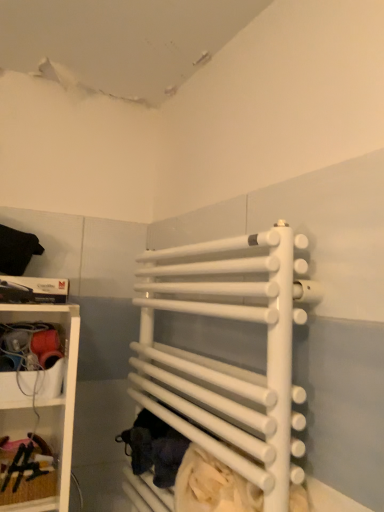
The image size is (384, 512). Identify the location of wooden at left. (55, 450).

What do you see at coordinates (55, 450) in the screenshot? Image resolution: width=384 pixels, height=512 pixels. I see `wooden at left` at bounding box center [55, 450].

Locate an element on the screen. Image resolution: width=384 pixels, height=512 pixels. white matte towel rack at center is located at coordinates (226, 362).

What do you see at coordinates (226, 362) in the screenshot? The height and width of the screenshot is (512, 384). I see `white matte towel rack at center` at bounding box center [226, 362].

Locate an element on the screen. The width and height of the screenshot is (384, 512). wooden at left is located at coordinates (55, 450).

Visually, is white matte towel rack at center positioned to the left or to the right of wooden at left?

white matte towel rack at center is to the right of wooden at left.

Which is behind, white matte towel rack at center or wooden at left?

wooden at left.

Considering the positions of point (144, 266) and point (72, 435), is point (144, 266) closer or farther from the camera than point (72, 435)?

Point (144, 266).

From the image's perspective, is white matte towel rack at center positioned above or below wooden at left?

white matte towel rack at center is situated higher than wooden at left in the image.

From a real-world perspective, is white matte towel rack at center physically below wooden at left?

No, from a real-world perspective, white matte towel rack at center is not beneath wooden at left.

Does white matte towel rack at center have a greater width compared to wooden at left?

Correct, the width of white matte towel rack at center exceeds that of wooden at left.

Who is taller, white matte towel rack at center or wooden at left?

white matte towel rack at center.

Considering the sizes of objects white matte towel rack at center and wooden at left in the image provided, who is bigger, white matte towel rack at center or wooden at left?

With larger size is white matte towel rack at center.

Is white matte towel rack at center spatially inside wooden at left, or outside of it?

The correct answer is: outside.

Are white matte towel rack at center and wooden at left far apart?

No, white matte towel rack at center is not far from wooden at left.

From the picture: Is white matte towel rack at center looking in the opposite direction of wooden at left?

No, white matte towel rack at center's orientation is not away from wooden at left.

What's the angular difference between white matte towel rack at center and wooden at left's facing directions?

There is a 87.7-degree angle between the facing directions of white matte towel rack at center and wooden at left.

Locate an element on the screen. The width and height of the screenshot is (384, 512). bunk bed on the right side of wooden at left is located at coordinates (226, 362).

Considering the positions of objects wooden at left and white matte towel rack at center in the image provided, who is more to the left, wooden at left or white matte towel rack at center?

wooden at left.

Considering the positions of objects wooden at left and white matte towel rack at center in the image provided, who is behind, wooden at left or white matte towel rack at center?

Positioned behind is wooden at left.

Considering the positions of point (61, 450) and point (140, 490), is point (61, 450) closer or farther from the camera than point (140, 490)?

Point (61, 450).

From the image's perspective, between wooden at left and white matte towel rack at center, which one is located above?

white matte towel rack at center is shown above in the image.

From a real-world perspective, is wooden at left physically above white matte towel rack at center?

No, from a real-world perspective, wooden at left is not above white matte towel rack at center.

Which of these two, wooden at left or white matte towel rack at center, is wider?

Wider between the two is white matte towel rack at center.

Between wooden at left and white matte towel rack at center, which one has more height?

With more height is white matte towel rack at center.

In terms of size, does wooden at left appear bigger or smaller than white matte towel rack at center?

Considering their sizes, wooden at left takes up less space than white matte towel rack at center.

Is white matte towel rack at center surrounded by wooden at left?

No, white matte towel rack at center is not surrounded by wooden at left.

Is wooden at left far from white matte towel rack at center?

wooden at left is near white matte towel rack at center, not far away.

Is wooden at left looking in the opposite direction of white matte towel rack at center?

No, white matte towel rack at center is not at the back of wooden at left.

Measure the distance between wooden at left and white matte towel rack at center.

They are 17.98 inches apart.

You are a GUI agent. You are given a task and a screenshot of the screen. Output one action in this format:
    pyautogui.click(x=<x>, y=<y>)
    Task: Click on the cabinet on the left side of white matte towel rack at center
    Image resolution: width=384 pixels, height=512 pixels.
    Given the screenshot: What is the action you would take?
    pyautogui.click(x=55, y=450)

I want to click on cabinet behind the white matte towel rack at center, so click(x=55, y=450).

Image resolution: width=384 pixels, height=512 pixels. What are the coordinates of `cabinet below the white matte towel rack at center (from a real-world perspective)` in the screenshot? It's located at (55, 450).